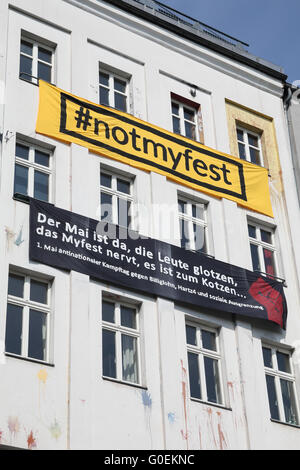
Where is `drapes`? Image resolution: width=300 pixels, height=470 pixels. drapes is located at coordinates (130, 352).